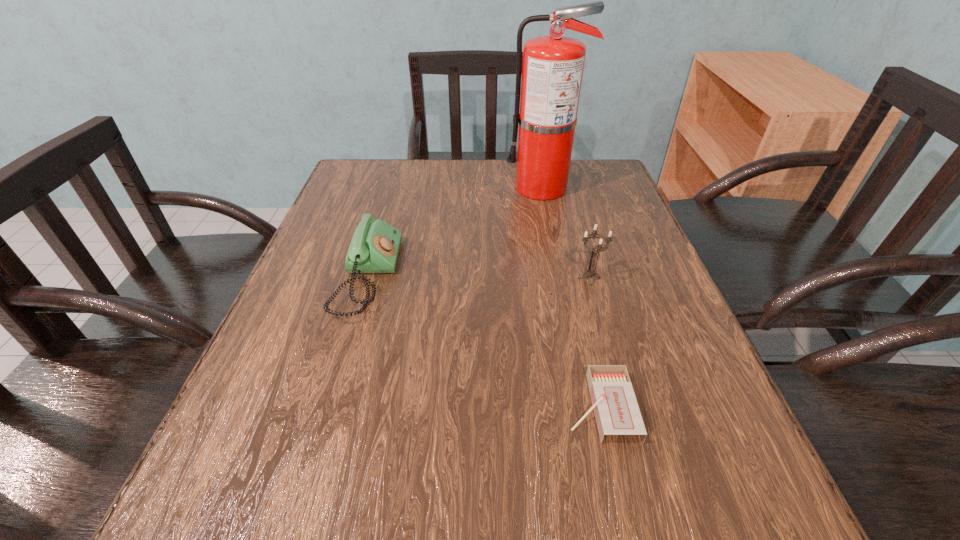
Identify the location of the farthest object. The width and height of the screenshot is (960, 540). (552, 69).

Identify the location of fire extinguisher. (552, 69).

Identify the location of candle holder. (590, 272).

The height and width of the screenshot is (540, 960). In order to click on the leftmost object in this screenshot , I will do `click(374, 248)`.

At what (x,y) coordinates should I click in order to perform the action: click on the third tallest object. Please return your answer as a coordinate pair (x, y). The width and height of the screenshot is (960, 540). Looking at the image, I should click on (374, 248).

Identify the location of the nearest object. (616, 410).

Find the location of `matchbox`. matchbox is located at coordinates (616, 410).

The image size is (960, 540). In order to click on free spot located at the nozzle of the fire extinguisher in this screenshot , I will do `click(452, 188)`.

This screenshot has height=540, width=960. Identify the location of vacant space located at the nozzle of the fire extinguisher. (418, 188).

I want to click on blank area located at the nozzle of the fire extinguisher, so click(468, 188).